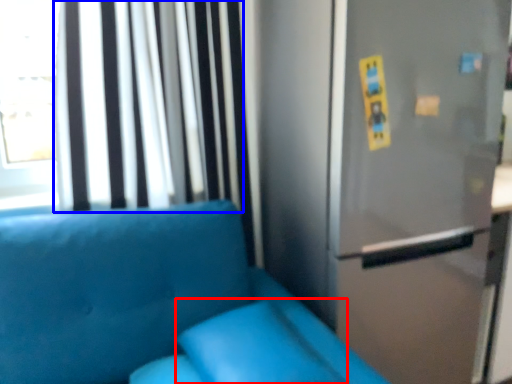
Question: Which point is closer to the camera, pillow (highlighted by a red box) or curtain (highlighted by a blue box)?

Choices:
 (A) pillow
 (B) curtain

Answer: (A)